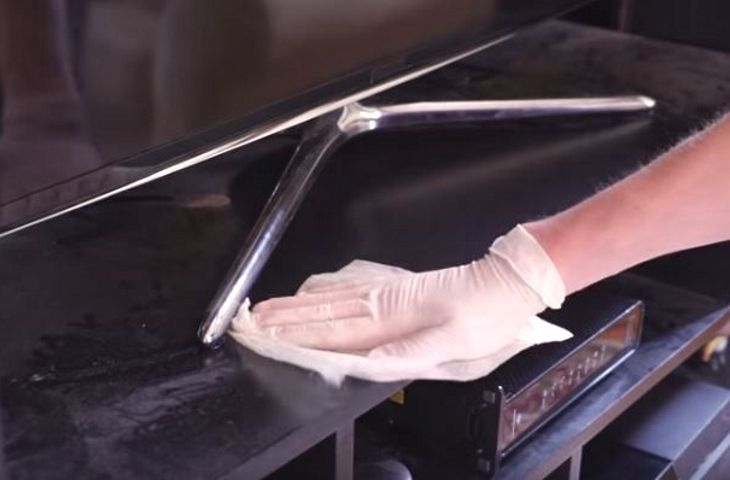
Where is `frame`? Image resolution: width=730 pixels, height=480 pixels. frame is located at coordinates (207, 133).